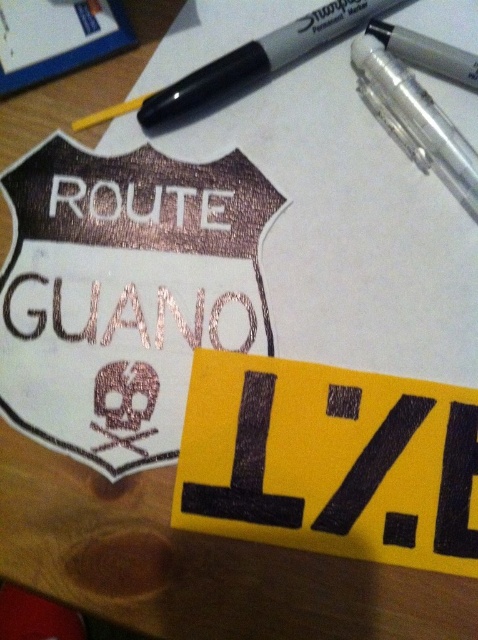
Can you confirm if yellow matte sign at lower right is bigger than clear plastic pen at upper right?

Indeed, yellow matte sign at lower right has a larger size compared to clear plastic pen at upper right.

Locate an element on the screen. yellow matte sign at lower right is located at coordinates (329, 461).

Where is `yellow matte sign at lower right`? The image size is (478, 640). yellow matte sign at lower right is located at coordinates (329, 461).

Can you confirm if rose gold metallic sign at upper center is taller than yellow matte sign at lower right?

Yes.

Is rose gold metallic sign at upper center bigger than yellow matte sign at lower right?

Correct, rose gold metallic sign at upper center is larger in size than yellow matte sign at lower right.

Between point (269, 182) and point (319, 365), which one is positioned in front?

Point (319, 365) is in front.

This screenshot has height=640, width=478. I want to click on rose gold metallic sign at upper center, so click(125, 292).

Is rose gold metallic sign at upper center smaller than metallic black marker at upper center?

No.

Is rose gold metallic sign at upper center shorter than metallic black marker at upper center?

In fact, rose gold metallic sign at upper center may be taller than metallic black marker at upper center.

Describe the element at coordinates (125, 292) in the screenshot. I see `rose gold metallic sign at upper center` at that location.

Find the location of a particular element. The width and height of the screenshot is (478, 640). rose gold metallic sign at upper center is located at coordinates (125, 292).